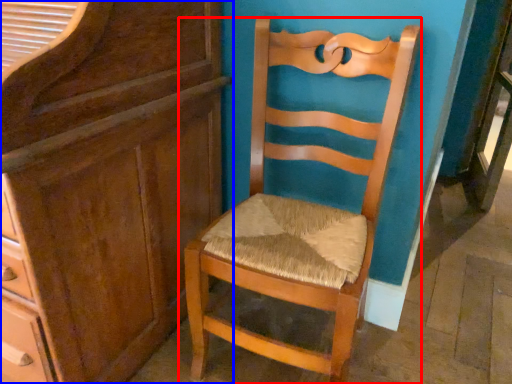
Question: Among these objects, which one is farthest to the camera, chair (highlighted by a red box) or cabinetry (highlighted by a blue box)?

Choices:
 (A) chair
 (B) cabinetry

Answer: (A)